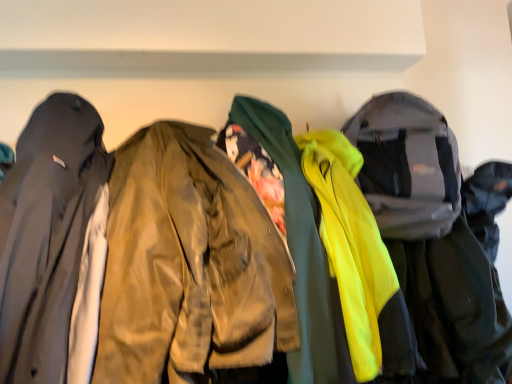
Question: Is there a large distance between matte black jacket at left, the 1th jacket when ordered from left to right, and matte olive green jacket at center, placed as the 2th jacket when sorted from right to left?

Choices:
 (A) no
 (B) yes

Answer: (A)

Question: Is matte black jacket at left, the 1th jacket when ordered from left to right, to the right of matte olive green jacket at center, the second jacket in the left-to-right sequence, from the viewer's perspective?

Choices:
 (A) yes
 (B) no

Answer: (B)

Question: Does matte black jacket at left, the 1th jacket when ordered from left to right, lie behind matte olive green jacket at center, the second jacket in the left-to-right sequence?

Choices:
 (A) yes
 (B) no

Answer: (B)

Question: Is matte black jacket at left, which is counted as the 3th jacket, starting from the right, taller than matte olive green jacket at center, placed as the 2th jacket when sorted from right to left?

Choices:
 (A) yes
 (B) no

Answer: (B)

Question: Does matte black jacket at left, the 1th jacket when ordered from left to right, lie in front of matte olive green jacket at center, placed as the 2th jacket when sorted from right to left?

Choices:
 (A) yes
 (B) no

Answer: (A)

Question: Would you say matte black jacket at left, which is counted as the 3th jacket, starting from the right, is outside matte olive green jacket at center, the second jacket in the left-to-right sequence?

Choices:
 (A) yes
 (B) no

Answer: (A)

Question: Does matte olive green jacket at center, placed as the 2th jacket when sorted from right to left, contain matte black jacket at left, which is counted as the 3th jacket, starting from the right?

Choices:
 (A) no
 (B) yes

Answer: (A)

Question: Can you confirm if matte olive green jacket at center, placed as the 2th jacket when sorted from right to left, is positioned to the right of matte black jacket at left, the 1th jacket when ordered from left to right?

Choices:
 (A) no
 (B) yes

Answer: (B)

Question: Is matte olive green jacket at center, placed as the 2th jacket when sorted from right to left, facing towards matte black jacket at left, the 1th jacket when ordered from left to right?

Choices:
 (A) yes
 (B) no

Answer: (B)

Question: Is the depth of matte olive green jacket at center, the second jacket in the left-to-right sequence, greater than that of matte black jacket at left, the 1th jacket when ordered from left to right?

Choices:
 (A) yes
 (B) no

Answer: (A)

Question: From the image's perspective, is matte olive green jacket at center, placed as the 2th jacket when sorted from right to left, on top of matte black jacket at left, the 1th jacket when ordered from left to right?

Choices:
 (A) yes
 (B) no

Answer: (B)

Question: Considering the relative sizes of matte olive green jacket at center, placed as the 2th jacket when sorted from right to left, and matte black jacket at left, the 1th jacket when ordered from left to right, in the image provided, is matte olive green jacket at center, placed as the 2th jacket when sorted from right to left, bigger than matte black jacket at left, the 1th jacket when ordered from left to right,?

Choices:
 (A) no
 (B) yes

Answer: (B)

Question: Does neon yellow fabric jacket at right, acting as the 1th jacket starting from the right, have a greater width compared to matte black jacket at left, which is counted as the 3th jacket, starting from the right?

Choices:
 (A) yes
 (B) no

Answer: (B)